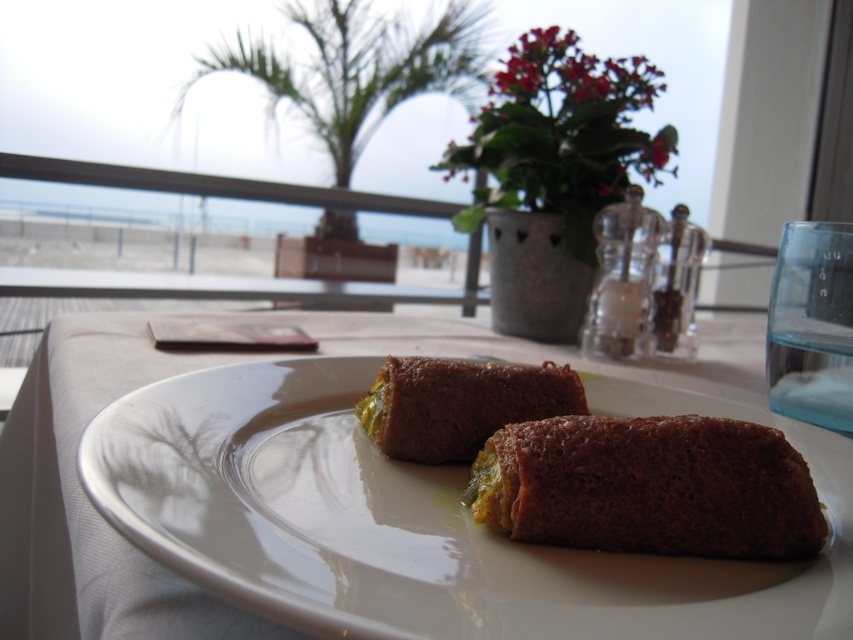
Question: Can you confirm if dark brown crumbly cake at center is positioned to the left of brown crumbly cake at center?

Choices:
 (A) no
 (B) yes

Answer: (A)

Question: Estimate the real-world distances between objects in this image. Which object is closer to the brown crumbly cake at center?

Choices:
 (A) dark brown crumbly cake at center
 (B) brown crispy pastry at center

Answer: (A)

Question: Which point appears farthest from the camera in this image?

Choices:
 (A) (770, 460)
 (B) (561, 618)
 (C) (531, 390)

Answer: (C)

Question: Observing the image, what is the correct spatial positioning of dark brown crumbly cake at center in reference to brown crumbly cake at center?

Choices:
 (A) left
 (B) right

Answer: (B)

Question: Which point is closer to the camera?

Choices:
 (A) (236, 538)
 (B) (775, 520)

Answer: (A)

Question: Is dark brown crumbly cake at center thinner than brown crumbly cake at center?

Choices:
 (A) yes
 (B) no

Answer: (B)